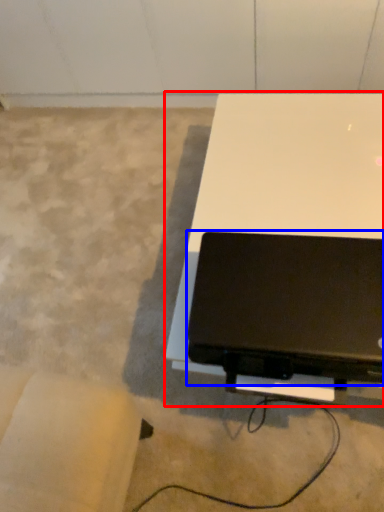
Question: Which point is closer to the camera, table (highlighted by a red box) or laptop (highlighted by a blue box)?

Choices:
 (A) table
 (B) laptop

Answer: (B)